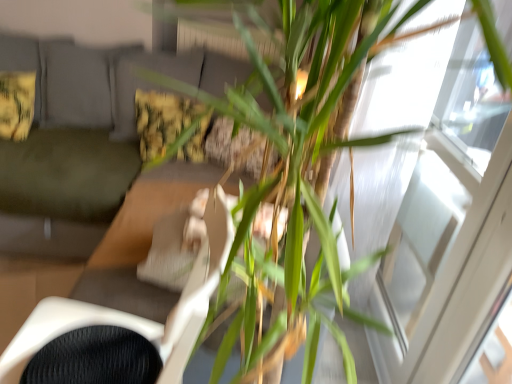
Question: Based on their sizes in the image, would you say white mesh swivel chair at center is bigger or smaller than transparent glass window at upper right?

Choices:
 (A) big
 (B) small

Answer: (A)

Question: Considering the positions of white mesh swivel chair at center and transparent glass window at upper right in the image, is white mesh swivel chair at center wider or thinner than transparent glass window at upper right?

Choices:
 (A) thin
 (B) wide

Answer: (B)

Question: Considering the real-world distances, which object is farthest from the green leafy plant at center?

Choices:
 (A) fluffy yellow pillow at center, the 1th pillow positioned from the right
 (B) fluffy yellow pillow at upper left, which is the first pillow from left to right
 (C) green fabric couch at left
 (D) white mesh swivel chair at center
 (E) transparent glass window at upper right

Answer: (B)

Question: Based on their relative distances, which object is nearer to the transparent glass window at upper right?

Choices:
 (A) green leafy plant at center
 (B) fluffy yellow pillow at upper left, which is the first pillow from left to right
 (C) fluffy yellow pillow at center, placed as the second pillow when sorted from left to right
 (D) green fabric couch at left
 (E) white mesh swivel chair at center

Answer: (A)